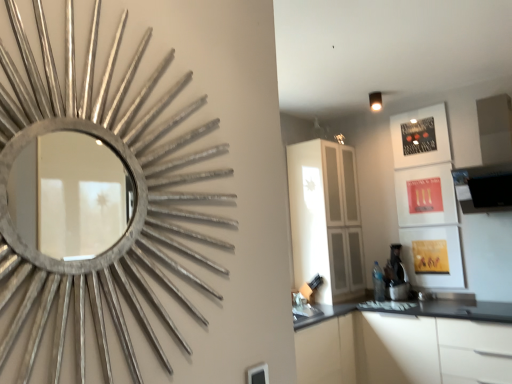
Question: Considering the relative positions of white glossy cabinet at center and silver metallic mirror at upper left in the image provided, is white glossy cabinet at center to the right of silver metallic mirror at upper left from the viewer's perspective?

Choices:
 (A) yes
 (B) no

Answer: (A)

Question: Is white glossy cabinet at center far away from silver metallic mirror at upper left?

Choices:
 (A) yes
 (B) no

Answer: (A)

Question: Is white glossy cabinet at center positioned beyond the bounds of silver metallic mirror at upper left?

Choices:
 (A) no
 (B) yes

Answer: (B)

Question: Would you say white glossy cabinet at center contains silver metallic mirror at upper left?

Choices:
 (A) no
 (B) yes

Answer: (A)

Question: From the image's perspective, is white glossy cabinet at center beneath silver metallic mirror at upper left?

Choices:
 (A) no
 (B) yes

Answer: (B)

Question: Is silver metallic mirror at upper left taller or shorter than black plastic coffee machine at lower right?

Choices:
 (A) short
 (B) tall

Answer: (B)

Question: Considering the relative positions of silver metallic mirror at upper left and black plastic coffee machine at lower right in the image provided, is silver metallic mirror at upper left to the left or to the right of black plastic coffee machine at lower right?

Choices:
 (A) right
 (B) left

Answer: (B)

Question: From a real-world perspective, is silver metallic mirror at upper left above or below black plastic coffee machine at lower right?

Choices:
 (A) above
 (B) below

Answer: (A)

Question: Choose the correct answer: Is silver metallic mirror at upper left inside black plastic coffee machine at lower right or outside it?

Choices:
 (A) outside
 (B) inside

Answer: (A)

Question: Is point (356, 246) closer or farther from the camera than point (325, 324)?

Choices:
 (A) closer
 (B) farther

Answer: (B)

Question: Is white glossy cabinet at center wider or thinner than white matte cabinet at lower right?

Choices:
 (A) thin
 (B) wide

Answer: (A)

Question: Is white glossy cabinet at center bigger or smaller than white matte cabinet at lower right?

Choices:
 (A) small
 (B) big

Answer: (A)

Question: Is white glossy cabinet at center spatially inside white matte cabinet at lower right, or outside of it?

Choices:
 (A) outside
 (B) inside

Answer: (A)

Question: From a real-world perspective, is black plastic coffee machine at lower right physically located above or below white matte cabinet at lower right?

Choices:
 (A) below
 (B) above

Answer: (B)

Question: Considering their positions, is black plastic coffee machine at lower right located in front of or behind white matte cabinet at lower right?

Choices:
 (A) front
 (B) behind

Answer: (B)